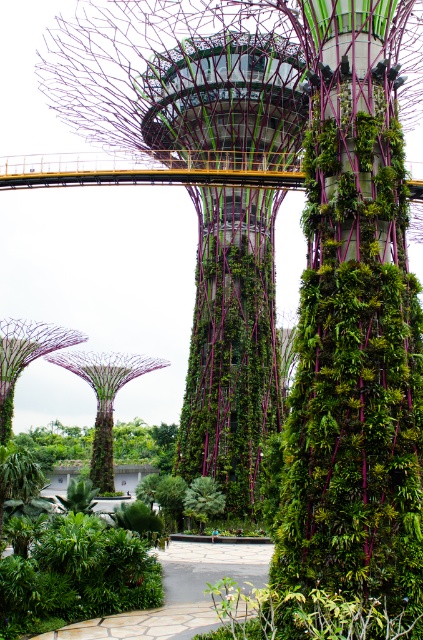
Is green textured tower at center closer to the viewer compared to green leafy tree at lower left?

Yes, green textured tower at center is closer to the viewer.

Consider the image. Who is more forward, (252,380) or (40,452)?

Positioned in front is point (252,380).

Find the location of a particular element. green textured tower at center is located at coordinates (231, 342).

What do you see at coordinates (145, 444) in the screenshot? I see `green leafy tree at lower left` at bounding box center [145, 444].

Does green leafy tree at lower left have a lesser height compared to green leafy tree at center?

No, green leafy tree at lower left is not shorter than green leafy tree at center.

I want to click on green leafy tree at lower left, so click(145, 444).

At what (x,y) coordinates should I click in order to perform the action: click on green leafy tree at lower left. Please return your answer as a coordinate pair (x, y). Looking at the image, I should click on (145, 444).

Does green textured tower at center appear under green leafy tree at center?

Actually, green textured tower at center is above green leafy tree at center.

Which of these two, green textured tower at center or green leafy tree at center, stands taller?

With more height is green textured tower at center.

Find the location of a particular element. green textured tower at center is located at coordinates (231, 342).